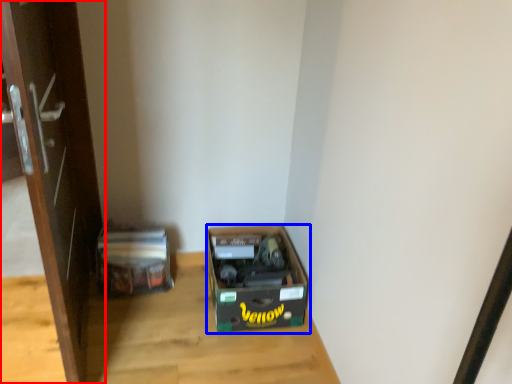
Question: Among these objects, which one is nearest to the camera, door (highlighted by a red box) or box (highlighted by a blue box)?

Choices:
 (A) door
 (B) box

Answer: (A)